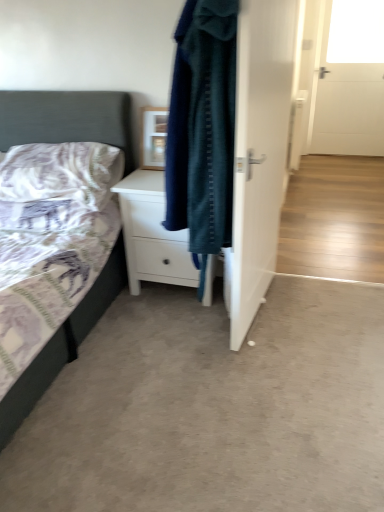
Question: Is white matte chest of drawers at center further to the viewer compared to matte wooden picture frame at center?

Choices:
 (A) yes
 (B) no

Answer: (B)

Question: Is white matte chest of drawers at center oriented towards matte wooden picture frame at center?

Choices:
 (A) no
 (B) yes

Answer: (A)

Question: Does white matte chest of drawers at center appear on the right side of matte wooden picture frame at center?

Choices:
 (A) yes
 (B) no

Answer: (A)

Question: Is there a large distance between white matte chest of drawers at center and matte wooden picture frame at center?

Choices:
 (A) no
 (B) yes

Answer: (A)

Question: Is white matte chest of drawers at center smaller than matte wooden picture frame at center?

Choices:
 (A) no
 (B) yes

Answer: (A)

Question: Is white matte chest of drawers at center with matte wooden picture frame at center?

Choices:
 (A) no
 (B) yes

Answer: (A)

Question: Are white glossy door at center and white matte chest of drawers at center located far from each other?

Choices:
 (A) no
 (B) yes

Answer: (A)

Question: Does white glossy door at center have a larger size compared to white matte chest of drawers at center?

Choices:
 (A) no
 (B) yes

Answer: (A)

Question: Can you confirm if white glossy door at center is positioned to the left of white matte chest of drawers at center?

Choices:
 (A) no
 (B) yes

Answer: (A)

Question: From the image's perspective, is white glossy door at center on white matte chest of drawers at center?

Choices:
 (A) no
 (B) yes

Answer: (B)

Question: Considering the relative sizes of white glossy door at center and white matte chest of drawers at center in the image provided, is white glossy door at center wider than white matte chest of drawers at center?

Choices:
 (A) no
 (B) yes

Answer: (A)

Question: Would you say white glossy door at center is outside white matte chest of drawers at center?

Choices:
 (A) no
 (B) yes

Answer: (B)

Question: Is white matte chest of drawers at center at the left side of transparent glass window at upper right?

Choices:
 (A) yes
 (B) no

Answer: (A)